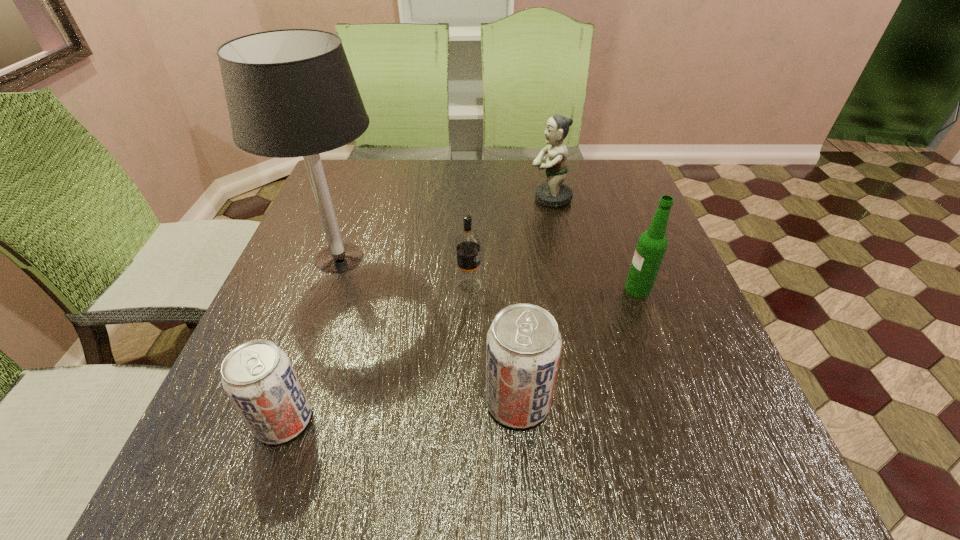
Locate an element on the screen. The height and width of the screenshot is (540, 960). table lamp situated at the left edge is located at coordinates (290, 93).

The width and height of the screenshot is (960, 540). In order to click on object present at the right edge in this screenshot , I will do `click(652, 244)`.

The image size is (960, 540). Find the location of `object positioned at the near left corner`. object positioned at the near left corner is located at coordinates (257, 376).

Find the location of a particular element. Image resolution: width=960 pixels, height=540 pixels. blank space at the far edge of the desktop is located at coordinates (452, 201).

Image resolution: width=960 pixels, height=540 pixels. I want to click on free location at the near edge of the desktop, so click(x=603, y=391).

In the image, there is a desktop. Where is `vacant area at the left edge`? This screenshot has height=540, width=960. vacant area at the left edge is located at coordinates (301, 367).

This screenshot has width=960, height=540. I want to click on vacant space at the right edge of the desktop, so click(672, 298).

You are a GUI agent. You are given a task and a screenshot of the screen. Output one action in this format:
    pyautogui.click(x=<x>, y=<y>)
    Task: Click on the free spot at the far left corner of the desktop
    The height and width of the screenshot is (540, 960).
    Given the screenshot: What is the action you would take?
    pyautogui.click(x=357, y=166)

You are a GUI agent. You are given a task and a screenshot of the screen. Output one action in this format:
    pyautogui.click(x=<x>, y=<y>)
    Task: Click on the vacant space at the far right corner
    The width and height of the screenshot is (960, 540).
    Given the screenshot: What is the action you would take?
    pyautogui.click(x=634, y=184)

Where is `vacant space that's between the third object from left to right and the shorter soda can`? The image size is (960, 540). vacant space that's between the third object from left to right and the shorter soda can is located at coordinates (376, 353).